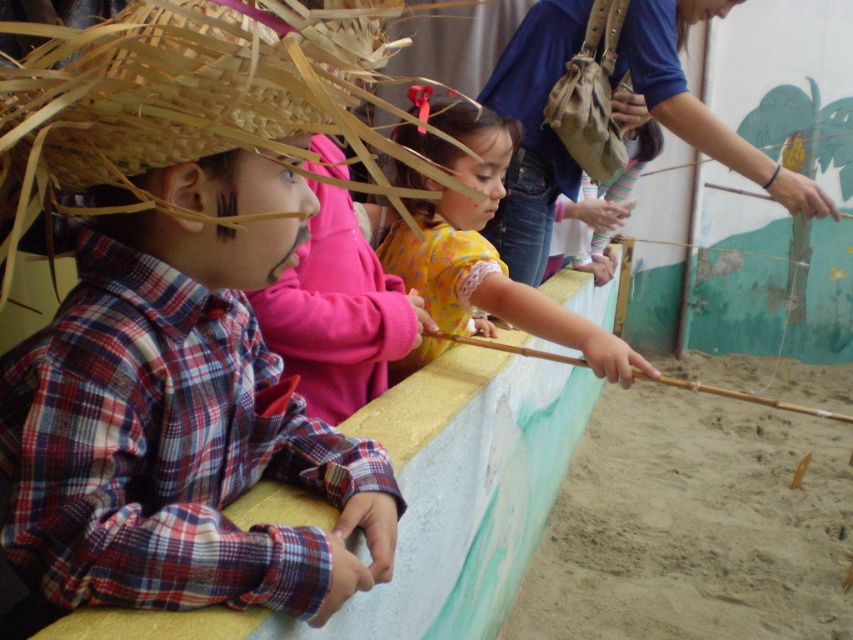
You are a parent trying to locate your child who is wearing a plaid fabric shirt at left and holding a brown wooden stick at center. Based on the scene description, where should you look relative to the stick to find the child?

The plaid fabric shirt at left is located above the brown wooden stick at center, so you should look above the stick to find the child wearing the plaid fabric shirt at left.

You are a photographer trying to capture the child with the brown woven straw hat at left in your shot. Based on the coordinates provided, where should you position your camera to ensure the hat is centered in the frame?

The brown woven straw hat at left is located at point coordinates, so you should position your camera to center the frame at those coordinates to capture the hat properly.